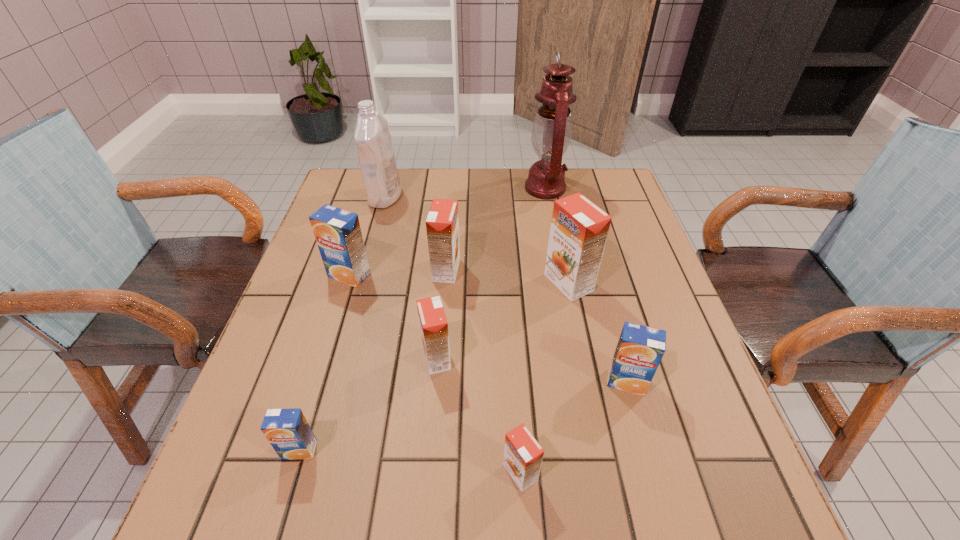
In the image, there is a desktop. Where is `vacant space at the near edge`? The image size is (960, 540). vacant space at the near edge is located at coordinates (498, 519).

I want to click on vacant region at the left edge of the desktop, so click(x=307, y=292).

In the image, there is a desktop. Where is `vacant space at the right edge`? vacant space at the right edge is located at coordinates (670, 435).

Identify the location of vacant region at the far left corner of the desktop. This screenshot has width=960, height=540. (371, 206).

The height and width of the screenshot is (540, 960). In the image, there is a desktop. What are the coordinates of `vacant space at the near left corner` in the screenshot? It's located at (195, 529).

The image size is (960, 540). What are the coordinates of `free space at the far right corner of the desktop` in the screenshot? It's located at (601, 174).

The image size is (960, 540). Find the location of `vacant space that's between the second tallest object and the biggest blue orange_juice`. vacant space that's between the second tallest object and the biggest blue orange_juice is located at coordinates (368, 236).

Where is `free space between the detergent and the nearest blue orange_juice`? free space between the detergent and the nearest blue orange_juice is located at coordinates (343, 323).

Where is `free space that is in between the fifth orange juice from left to right and the third smallest orange orange juice`? Image resolution: width=960 pixels, height=540 pixels. free space that is in between the fifth orange juice from left to right and the third smallest orange orange juice is located at coordinates (483, 372).

This screenshot has height=540, width=960. Identify the location of vacant area that lies between the second nearest orange orange juice and the biggest blue orange_juice. (393, 316).